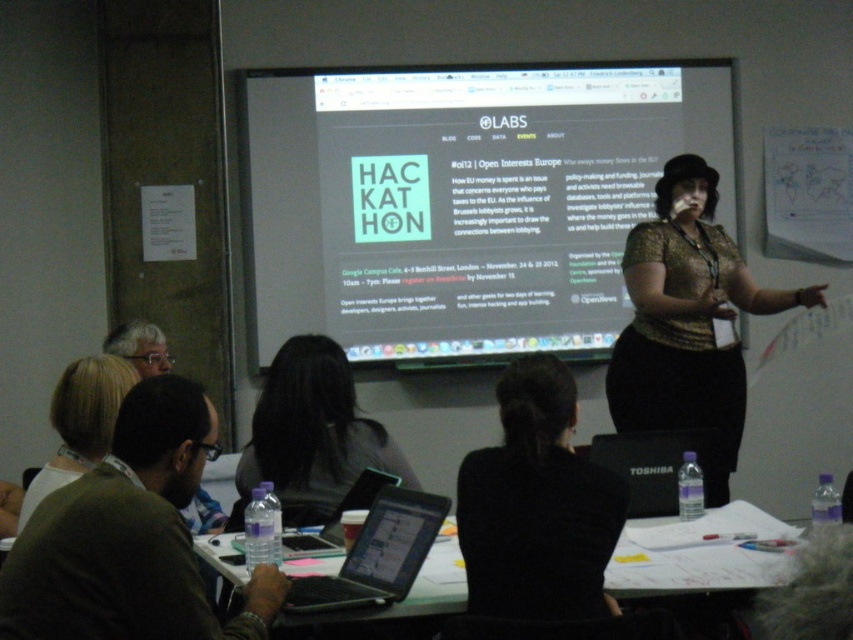
Consider the image. You are attending the presentation and want to know which object is taller between the white glossy projection screen at upper center and the black glossy laptop at center. Can you determine this based on the scene?

The white glossy projection screen at upper center has a greater height compared to the black glossy laptop at center, so the white glossy projection screen at upper center is taller.

You are attending a virtual meeting and need to focus on the presenter. Which object is closer to you between the gold textured blouse at center and the black fabric hair at center?

A: The gold textured blouse at center is closer to you than the black fabric hair at center.

You are an attendee at the presentation. You want to take a photo of the slide on the screen but need to ensure the blonde hair at lower left and the black glossy laptop at center are not blocking the view. Based on their positions, can you determine if the slide is fully visible?

The blonde hair at lower left is positioned on the left side of the black glossy laptop at center, so the slide on the screen should be fully visible as the objects are to the side of the screen and not obstructing it.